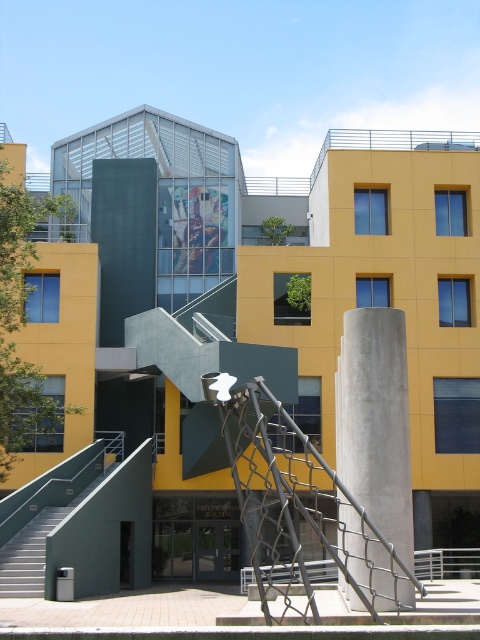
Does concrete at center have a smaller size compared to smooth concrete stairs at lower left?

No, concrete at center is not smaller than smooth concrete stairs at lower left.

Is concrete at center below smooth concrete stairs at lower left?

Actually, concrete at center is above smooth concrete stairs at lower left.

Between point (382, 465) and point (3, 582), which one is positioned in front?

Point (382, 465)

This screenshot has height=640, width=480. I want to click on concrete at center, so click(x=375, y=420).